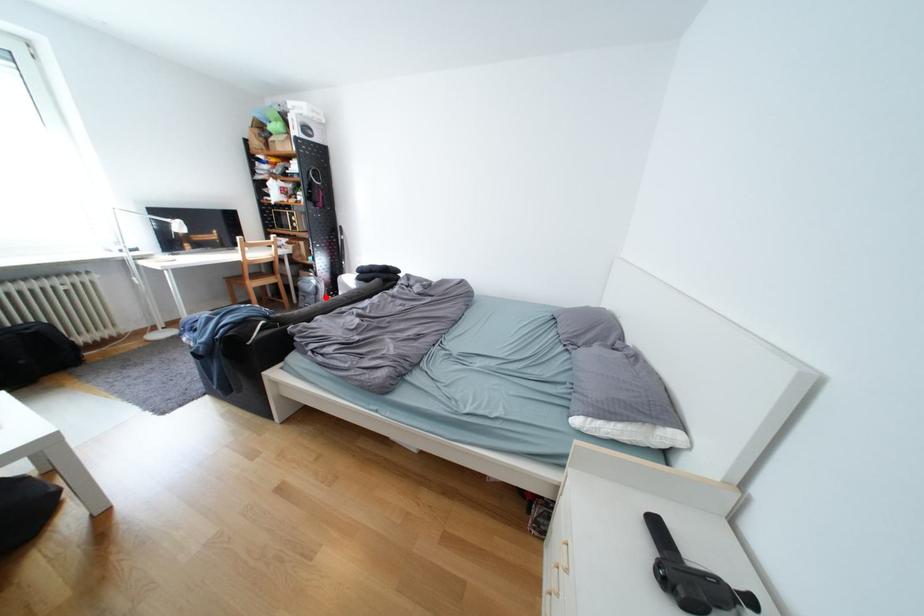
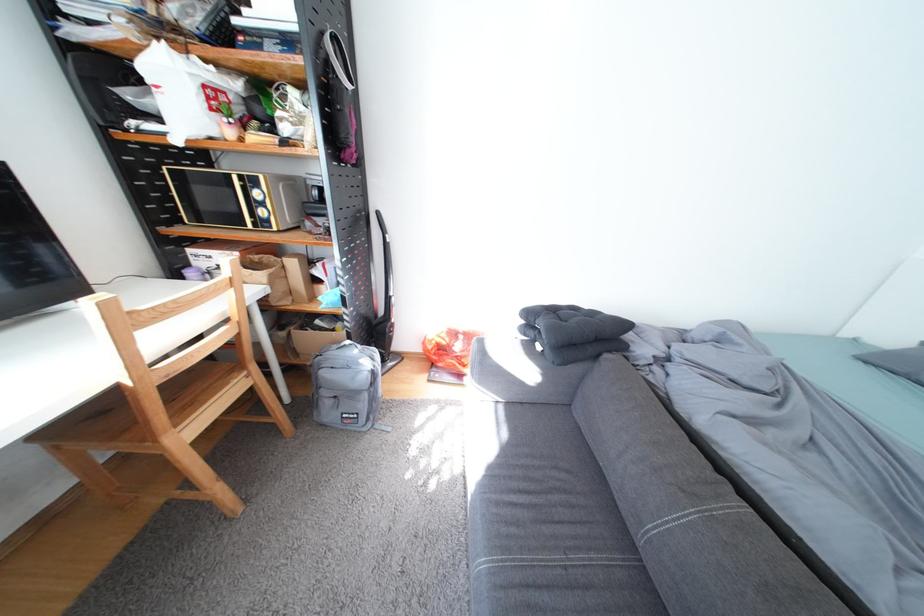
Where in the second image is the point corresponding to the highlighted location from the first image?

(378, 397)